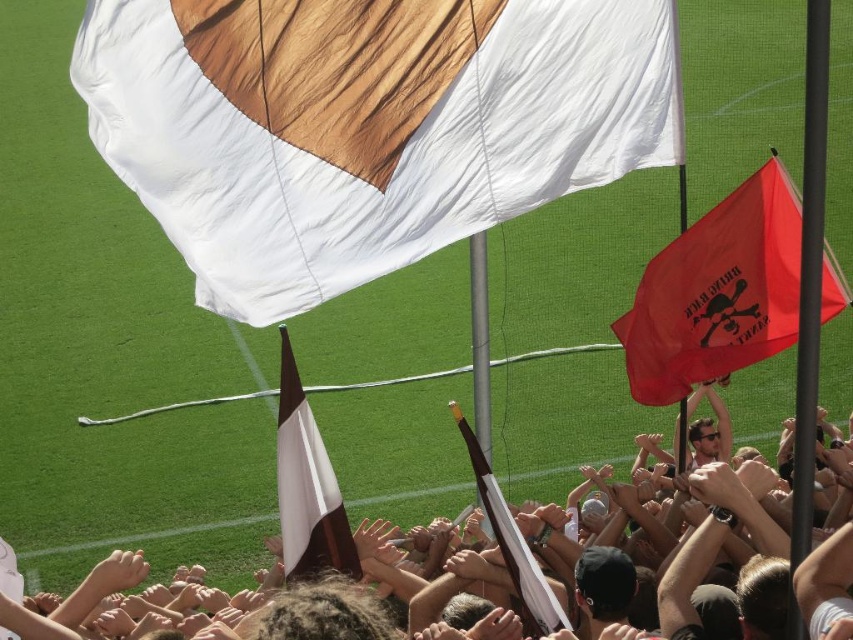
Question: Which object is farther from the camera taking this photo?

Choices:
 (A) white fabric flag at upper center
 (B) white fabric flag at center
 (C) brown leather jacket at center
 (D) red fabric flag at right

Answer: (D)

Question: Among these points, which one is farthest from the camera?

Choices:
 (A) (508, 516)
 (B) (450, 77)
 (C) (335, 570)
 (D) (125, 568)

Answer: (D)

Question: Does brown leather jacket at center come behind brown/white fabric flag at center?

Choices:
 (A) yes
 (B) no

Answer: (A)

Question: Can you confirm if brown leather jacket at center is smaller than brown/white fabric flag at center?

Choices:
 (A) yes
 (B) no

Answer: (A)

Question: Can you confirm if red fabric flag at right is smaller than brown leather jacket at center?

Choices:
 (A) no
 (B) yes

Answer: (A)

Question: Which point is closer to the camera taking this photo?

Choices:
 (A) (544, 598)
 (B) (764, 342)
 (C) (109, 580)

Answer: (A)